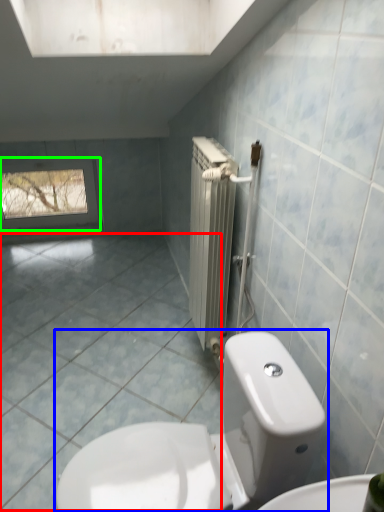
Question: Considering the real-world distances, which object is farthest from ceramic tile (highlighted by a red box)? toilet (highlighted by a blue box) or window (highlighted by a green box)?

Choices:
 (A) toilet
 (B) window

Answer: (B)